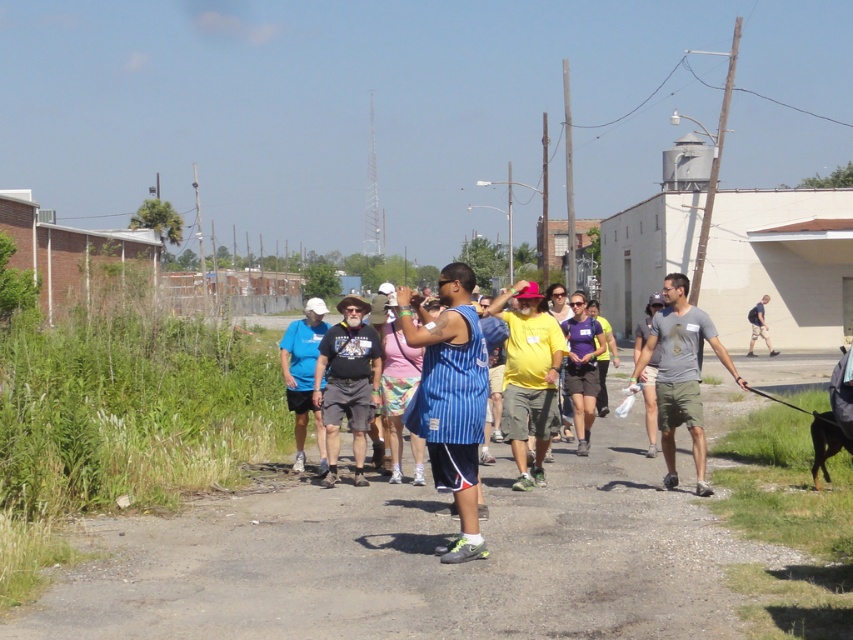
Is the position of dark blue striped tank top at center more distant than that of black fur dog at lower right?

Yes, dark blue striped tank top at center is behind black fur dog at lower right.

Is point (331, 356) more distant than point (839, 429)?

Yes, point (331, 356) is behind point (839, 429).

Which is in front, point (355, 353) or point (815, 460)?

Positioned in front is point (815, 460).

Where is `dark blue striped tank top at center`? This screenshot has width=853, height=640. dark blue striped tank top at center is located at coordinates (347, 381).

Looking at this image, can you confirm if purple fabric shirt at center is bigger than gray fabric backpack at center-right?

No.

Can you confirm if purple fabric shirt at center is smaller than gray fabric backpack at center-right?

Correct, purple fabric shirt at center occupies less space than gray fabric backpack at center-right.

Image resolution: width=853 pixels, height=640 pixels. What do you see at coordinates (581, 365) in the screenshot? I see `purple fabric shirt at center` at bounding box center [581, 365].

Where is `purple fabric shirt at center`? The width and height of the screenshot is (853, 640). purple fabric shirt at center is located at coordinates (581, 365).

Does matte blue shirt at center lie behind gray fabric backpack at center-right?

No.

Does point (297, 412) come farther from viewer compared to point (759, 323)?

No, it is in front of (759, 323).

Locate an element on the screen. The height and width of the screenshot is (640, 853). matte blue shirt at center is located at coordinates pos(303,376).